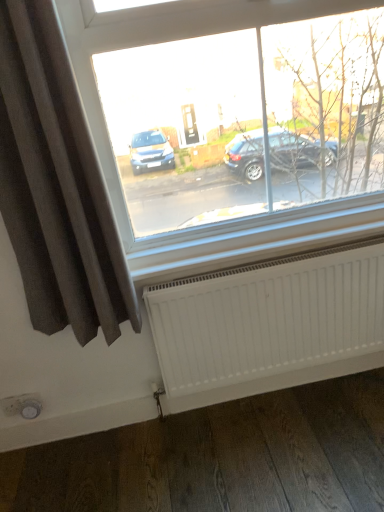
Where is `free region under dark grey fabric curtain at left (from a real-world perspective)`? The height and width of the screenshot is (512, 384). free region under dark grey fabric curtain at left (from a real-world perspective) is located at coordinates (115, 439).